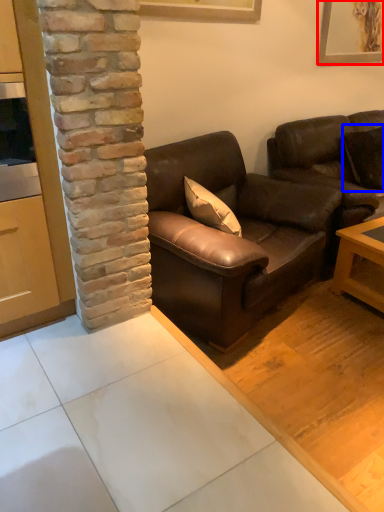
Question: Which of the following is the closest to the observer, picture frame (highlighted by a red box) or pillow (highlighted by a blue box)?

Choices:
 (A) picture frame
 (B) pillow

Answer: (B)